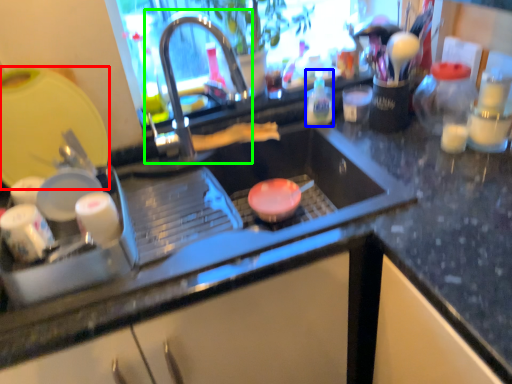
Question: Which object is positioned closest to appliance (highlighted by a red box)? Select from bottle (highlighted by a blue box) and tap (highlighted by a green box).

Choices:
 (A) bottle
 (B) tap

Answer: (B)